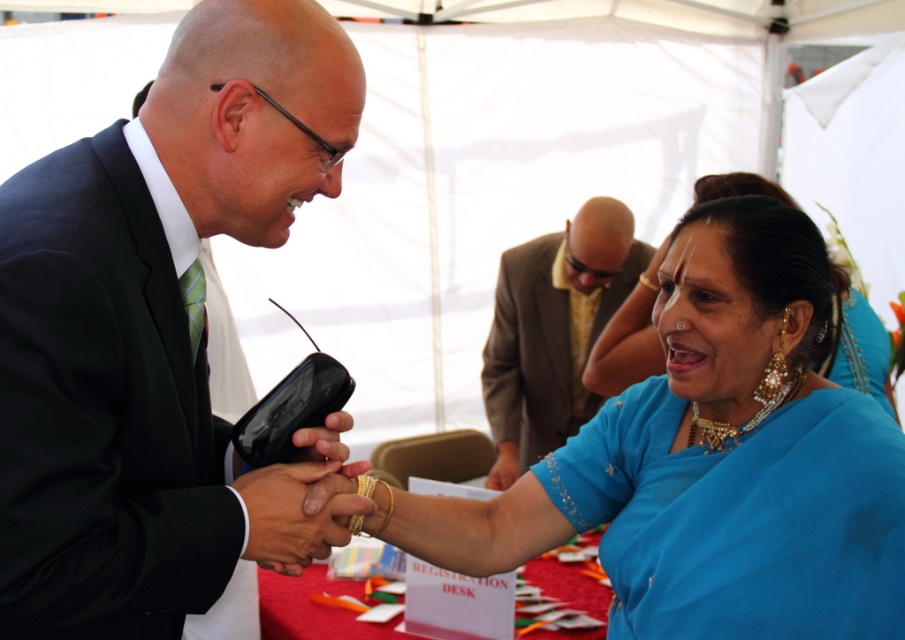
Is brown textured suit at upper center positioned behind blue silk saree at lower right?

Yes.

Who is higher up, brown textured suit at upper center or blue silk saree at lower right?

blue silk saree at lower right is higher up.

Which is behind, point (588, 412) or point (837, 269)?

Positioned behind is point (588, 412).

The image size is (905, 640). In order to click on brown textured suit at upper center in this screenshot , I will do `click(553, 330)`.

Is black matte suit at center further to the viewer compared to blue silk saree at center?

That is False.

Which is in front, point (115, 339) or point (418, 528)?

Point (115, 339)

Find the location of a particular element. The width and height of the screenshot is (905, 640). black matte suit at center is located at coordinates (160, 337).

Identify the location of black matte suit at center. This screenshot has height=640, width=905. (160, 337).

Where is `black matte suit at center`? Image resolution: width=905 pixels, height=640 pixels. black matte suit at center is located at coordinates (160, 337).

Between black matte suit at center and brown textured suit at upper center, which one has less height?

With less height is black matte suit at center.

Image resolution: width=905 pixels, height=640 pixels. I want to click on black matte suit at center, so click(x=160, y=337).